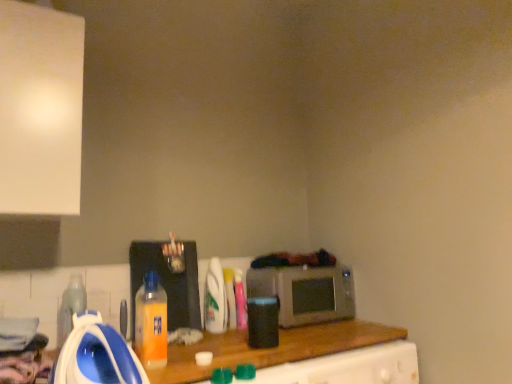
What do you see at coordinates (151, 322) in the screenshot? The image size is (512, 384). I see `orange plastic bottle at center, the 4th bottle from the right` at bounding box center [151, 322].

This screenshot has height=384, width=512. What do you see at coordinates (305, 293) in the screenshot?
I see `metallic silver microwave at center` at bounding box center [305, 293].

Measure the distance between point (x=337, y=287) and camera.

The depth of point (x=337, y=287) is 2.07 meters.

Locate an element on the screen. The width and height of the screenshot is (512, 384). orange plastic bottle at center, acting as the fifth bottle starting from the back is located at coordinates (151, 322).

Where is `microwave oven behind the translucent plastic bottle at lower left, which is the second bottle from front to back`? The width and height of the screenshot is (512, 384). microwave oven behind the translucent plastic bottle at lower left, which is the second bottle from front to back is located at coordinates (305, 293).

Considering the sizes of objects metallic silver microwave at center and translucent plastic bottle at lower left, the 5th bottle positioned from the right, in the image provided, who is thinner, metallic silver microwave at center or translucent plastic bottle at lower left, the 5th bottle positioned from the right,?

With smaller width is translucent plastic bottle at lower left, the 5th bottle positioned from the right.

Choose the correct answer: Is metallic silver microwave at center inside translucent plastic bottle at lower left, which is the first bottle from left to right, or outside it?

metallic silver microwave at center cannot be found inside translucent plastic bottle at lower left, which is the first bottle from left to right.

Could you tell me if metallic silver microwave at center is facing translucent plastic bottle at lower left, the fourth bottle in the back-to-front sequence?

No, metallic silver microwave at center is not turned towards translucent plastic bottle at lower left, the fourth bottle in the back-to-front sequence.

From the picture: Which is more to the right, metallic silver microwave at center or wooden at center?

From the viewer's perspective, metallic silver microwave at center appears more on the right side.

Is metallic silver microwave at center oriented away from wooden at center?

No, metallic silver microwave at center is not facing the opposite direction of wooden at center.

Is metallic silver microwave at center bigger or smaller than wooden at center?

Clearly, metallic silver microwave at center is smaller in size than wooden at center.

Who is shorter, translucent plastic bottle at center, which is the fifth bottle in left-to-right order, or translucent plastic bottle at center, placed as the fifth bottle when sorted from front to back?

translucent plastic bottle at center, placed as the fifth bottle when sorted from front to back.

Is translucent plastic bottle at center, which ranks as the 2th bottle in back-to-front order, further to the viewer compared to translucent plastic bottle at center, arranged as the 2th bottle when viewed from the right?

No, it is in front of translucent plastic bottle at center, arranged as the 2th bottle when viewed from the right.

From the image's perspective, is translucent plastic bottle at center, which ranks as the 2th bottle in back-to-front order, on top of translucent plastic bottle at center, placed as the fifth bottle when sorted from front to back?

Indeed, from the image's perspective, translucent plastic bottle at center, which ranks as the 2th bottle in back-to-front order, is shown above translucent plastic bottle at center, placed as the fifth bottle when sorted from front to back.

Is translucent plastic bottle at center, which is the fifth bottle in left-to-right order, touching translucent plastic bottle at center, placed as the fifth bottle when sorted from front to back?

Yes, translucent plastic bottle at center, which is the fifth bottle in left-to-right order, is touching translucent plastic bottle at center, placed as the fifth bottle when sorted from front to back.

Is wooden at center positioned beyond the bounds of translucent plastic bottle at center, arranged as the second appliance when viewed from the front?

That's correct, wooden at center is outside of translucent plastic bottle at center, arranged as the second appliance when viewed from the front.

Looking at this image, is wooden at center touching translucent plastic bottle at center, the first appliance viewed from the back?

wooden at center and translucent plastic bottle at center, the first appliance viewed from the back, are not in contact.

Considering the sizes of objects wooden at center and translucent plastic bottle at center, the first appliance viewed from the back, in the image provided, who is shorter, wooden at center or translucent plastic bottle at center, the first appliance viewed from the back,?

Standing shorter between the two is wooden at center.

From the image's perspective, is wooden at center below translucent plastic bottle at center, the first appliance viewed from the back?

Yes, from the image's perspective, wooden at center is below translucent plastic bottle at center, the first appliance viewed from the back.

Considering the positions of objects translucent plastic bottle at center, arranged as the second appliance when viewed from the front, and metallic silver microwave at center in the image provided, who is more to the left, translucent plastic bottle at center, arranged as the second appliance when viewed from the front, or metallic silver microwave at center?

From the viewer's perspective, translucent plastic bottle at center, arranged as the second appliance when viewed from the front, appears more on the left side.

Which of these two, translucent plastic bottle at center, arranged as the second appliance when viewed from the front, or metallic silver microwave at center, stands taller?

Standing taller between the two is translucent plastic bottle at center, arranged as the second appliance when viewed from the front.

Is point (132, 266) positioned after point (247, 297)?

That is False.

In the scene shown: From a real-world perspective, is translucent plastic bottle at center, the first appliance viewed from the back, physically below metallic silver microwave at center?

No, from a real-world perspective, translucent plastic bottle at center, the first appliance viewed from the back, is not below metallic silver microwave at center.

From the image's perspective, relative to translucent plastic bottle at center, placed as the fifth bottle when sorted from front to back, is translucent plastic bottle at lower left, which is the second bottle from front to back, above or below?

Clearly, from the image's perspective, translucent plastic bottle at lower left, which is the second bottle from front to back, is above translucent plastic bottle at center, placed as the fifth bottle when sorted from front to back.

Who is shorter, translucent plastic bottle at lower left, which is the second bottle from front to back, or translucent plastic bottle at center, acting as the fourth bottle starting from the left?

Standing shorter between the two is translucent plastic bottle at center, acting as the fourth bottle starting from the left.

Is translucent plastic bottle at lower left, which is the second bottle from front to back, far away from translucent plastic bottle at center, arranged as the 2th bottle when viewed from the right?

translucent plastic bottle at lower left, which is the second bottle from front to back, is actually quite close to translucent plastic bottle at center, arranged as the 2th bottle when viewed from the right.

At what (x,y) coordinates should I click in order to perform the action: click on bottle that is the 1st one when counting leftward from the wooden at center. Please return your answer as a coordinate pair (x, y). Image resolution: width=512 pixels, height=384 pixels. Looking at the image, I should click on (240, 300).

From the picture: Is wooden at center beside translucent plastic bottle at center, arranged as the 1th bottle when viewed from the right?

wooden at center and translucent plastic bottle at center, arranged as the 1th bottle when viewed from the right, are not in contact.

From the image's perspective, is wooden at center beneath translucent plastic bottle at center, arranged as the 1th bottle when viewed from the right?

Correct, wooden at center appears lower than translucent plastic bottle at center, arranged as the 1th bottle when viewed from the right, in the image.

Is wooden at center oriented away from translucent plastic bottle at center, which is the fourth bottle in front-to-back order?

No, wooden at center is not facing the opposite direction of translucent plastic bottle at center, which is the fourth bottle in front-to-back order.

Image resolution: width=512 pixels, height=384 pixels. I want to click on microwave oven behind the translucent plastic bottle at lower left, the 5th bottle positioned from the right, so click(305, 293).

Identify the location of counter top in front of the metallic silver microwave at center. (272, 349).

Estimate the real-world distances between objects in this image. Which object is further from orange plastic bottle at center, acting as the fifth bottle starting from the back, translucent plastic bottle at center, which ranks as the 2th bottle in back-to-front order, or translucent plastic bottle at center, the third bottle from the left?

translucent plastic bottle at center, which ranks as the 2th bottle in back-to-front order, is further to orange plastic bottle at center, acting as the fifth bottle starting from the back.

Considering their positions, is orange plastic bottle at center, which is counted as the second bottle, starting from the left, positioned closer to wooden at center than translucent plastic bottle at lower left, which is the first bottle from left to right?

orange plastic bottle at center, which is counted as the second bottle, starting from the left.

Which object lies further to the anchor point translucent plastic bottle at center, arranged as the second appliance when viewed from the front, blue plastic iron at lower left, arranged as the first appliance when viewed from the front, or translucent plastic bottle at lower left, which is the second bottle from front to back?

Based on the image, blue plastic iron at lower left, arranged as the first appliance when viewed from the front, appears to be further to translucent plastic bottle at center, arranged as the second appliance when viewed from the front.

Considering their positions, is translucent plastic bottle at center, which is counted as the third bottle, starting from the front, positioned closer to translucent plastic bottle at center, arranged as the first bottle when viewed from the back, than wooden at center?

Among the two, translucent plastic bottle at center, which is counted as the third bottle, starting from the front, is located nearer to translucent plastic bottle at center, arranged as the first bottle when viewed from the back.

Based on their spatial positions, is translucent plastic bottle at center, which ranks as the 2th bottle in back-to-front order, or wooden at center closer to translucent plastic bottle at center, the first appliance viewed from the back?

Based on the image, translucent plastic bottle at center, which ranks as the 2th bottle in back-to-front order, appears to be nearer to translucent plastic bottle at center, the first appliance viewed from the back.

When comparing their distances from translucent plastic bottle at center, the first appliance viewed from the back, does orange plastic bottle at center, the 4th bottle from the right, or translucent plastic bottle at center, acting as the fourth bottle starting from the left, seem further?

Based on the image, orange plastic bottle at center, the 4th bottle from the right, appears to be further to translucent plastic bottle at center, the first appliance viewed from the back.

Which object lies further to the anchor point translucent plastic bottle at lower left, the 5th bottle positioned from the right, wooden at center or translucent plastic bottle at center, arranged as the 2th bottle when viewed from the right?

wooden at center is further to translucent plastic bottle at lower left, the 5th bottle positioned from the right.

Estimate the real-world distances between objects in this image. Which object is further from translucent plastic bottle at center, arranged as the second appliance when viewed from the front, wooden at center or translucent plastic bottle at center, arranged as the 3th bottle when viewed from the back?

wooden at center lies further to translucent plastic bottle at center, arranged as the second appliance when viewed from the front, than the other object.

Locate an element on the screen. This screenshot has width=512, height=384. appliance positioned between orange plastic bottle at center, the 4th bottle from the right, and translucent plastic bottle at center, which is the fourth bottle in front-to-back order, from near to far is located at coordinates (167, 282).

Locate an element on the screen. This screenshot has height=384, width=512. counter top situated between translucent plastic bottle at center, arranged as the second appliance when viewed from the front, and metallic silver microwave at center from left to right is located at coordinates (272, 349).

You are a GUI agent. You are given a task and a screenshot of the screen. Output one action in this format:
    pyautogui.click(x=<x>, y=<y>)
    Task: Click on the counter top between blue plastic iron at lower left, which is counted as the 2th appliance, starting from the back, and translucent plastic bottle at center, which ranks as the 2th bottle in back-to-front order, from front to back
    This screenshot has width=512, height=384.
    Given the screenshot: What is the action you would take?
    pyautogui.click(x=272, y=349)

The image size is (512, 384). In order to click on appliance between orange plastic bottle at center, which is counted as the second bottle, starting from the left, and translucent plastic bottle at center, arranged as the 3th bottle when viewed from the back, along the z-axis in this screenshot , I will do `click(167, 282)`.